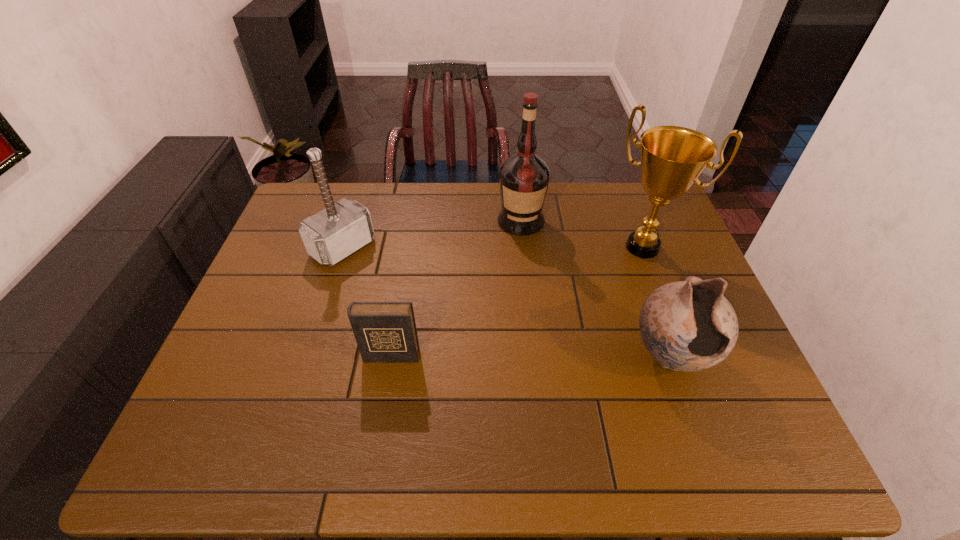
This screenshot has width=960, height=540. In order to click on free space between the second object from left to right and the hammer in this screenshot , I will do `click(367, 301)`.

Locate an element on the screen. The image size is (960, 540). free space between the diary and the hammer is located at coordinates (367, 301).

Find the location of `empty space between the liquor and the fourth object from right to left`. empty space between the liquor and the fourth object from right to left is located at coordinates coord(456,288).

The width and height of the screenshot is (960, 540). I want to click on free spot between the hammer and the fourth object from right to left, so [367, 301].

I want to click on unoccupied area between the diary and the award, so click(x=516, y=301).

At what (x,y) coordinates should I click in order to perform the action: click on empty location between the fourth object from right to left and the third tallest object. Please return your answer as a coordinate pair (x, y). The height and width of the screenshot is (540, 960). Looking at the image, I should click on (367, 301).

This screenshot has width=960, height=540. What are the coordinates of `object that is the fourth closest one to the award` in the screenshot? It's located at 332,234.

This screenshot has height=540, width=960. In order to click on object that ranks as the closest to the award in this screenshot , I will do `click(524, 177)`.